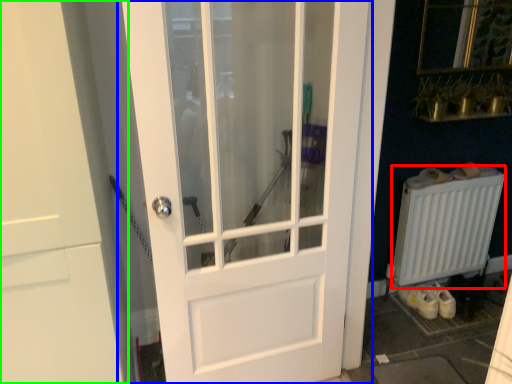
Question: Which is farther away from radiator (highlighted by a red box)? door (highlighted by a blue box) or door (highlighted by a green box)?

Choices:
 (A) door
 (B) door

Answer: (B)